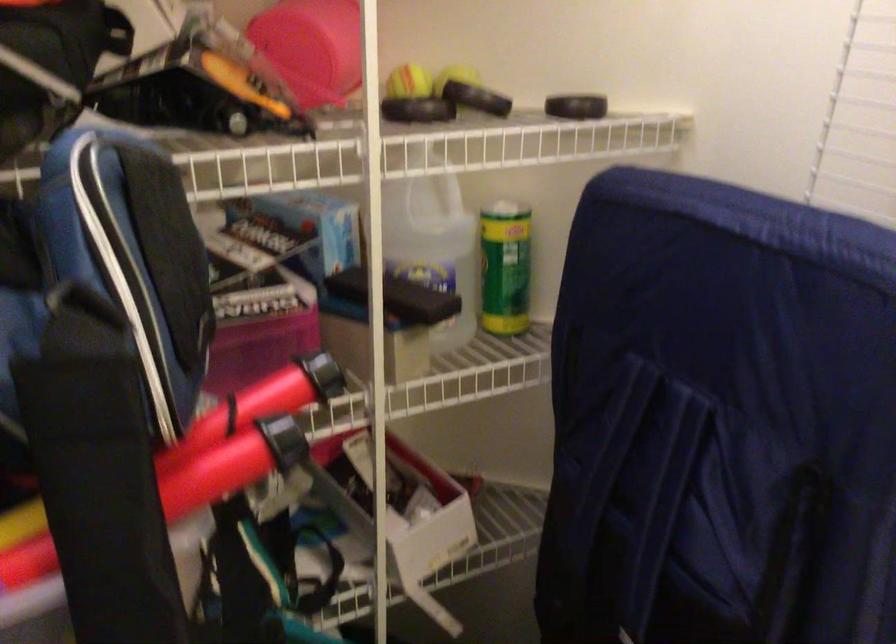
You are a GUI agent. You are given a task and a screenshot of the screen. Output one action in this format:
    pyautogui.click(x=<x>, y=<y>)
    Task: Click on the green and yellow can
    
    Given the screenshot: What is the action you would take?
    point(504,267)